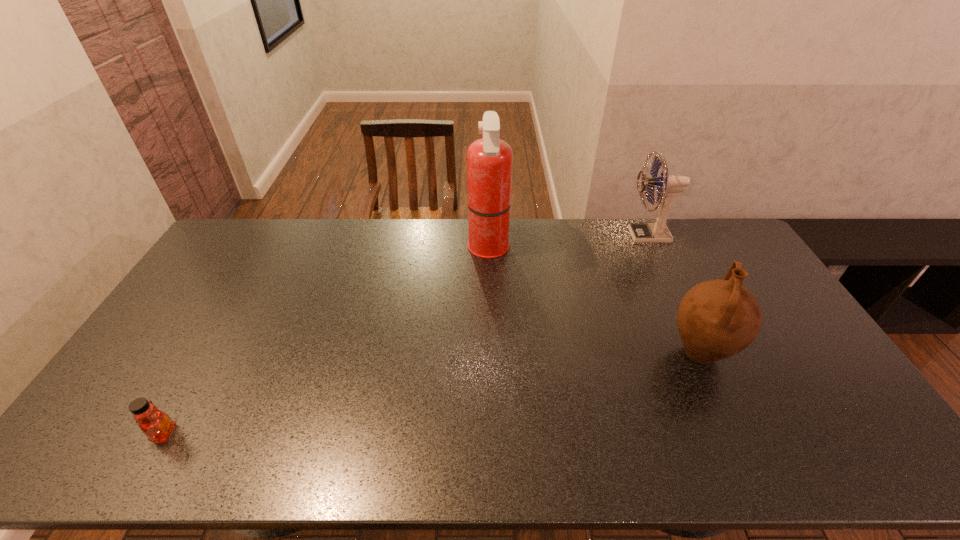
The width and height of the screenshot is (960, 540). What are the coordinates of `unoccupied position between the tallest object and the third farthest object` in the screenshot? It's located at (594, 301).

Where is `free space that is in between the tallest object and the pitcher`? The image size is (960, 540). free space that is in between the tallest object and the pitcher is located at coordinates (594, 301).

At what (x,y) coordinates should I click in order to perform the action: click on the second closest object relative to the fan. Please return your answer as a coordinate pair (x, y). This screenshot has height=540, width=960. Looking at the image, I should click on (489, 160).

This screenshot has width=960, height=540. Identify the location of object that is the second closest to the shortest object. (717, 319).

Locate an element on the screen. vacant space that satisfies the following two spatial constraints: 1. with the handle and hose on the pitcher; 2. on the right side of the fire extinguisher is located at coordinates (491, 354).

Image resolution: width=960 pixels, height=540 pixels. Find the location of `vacant region that satisfies the following two spatial constraints: 1. on the front-facing side of the fan; 2. on the front side of the second nearest object`. vacant region that satisfies the following two spatial constraints: 1. on the front-facing side of the fan; 2. on the front side of the second nearest object is located at coordinates (704, 354).

Identify the location of vacant region that satisfies the following two spatial constraints: 1. with the handle and hose on the second nearest object; 2. on the right side of the fire extinguisher. 491,354.

Locate an element on the screen. vacant region that satisfies the following two spatial constraints: 1. on the back side of the third farthest object; 2. with the handle and hose on the tallest object is located at coordinates (651, 249).

At what (x,y) coordinates should I click in order to perform the action: click on vacant area in the image that satisfies the following two spatial constraints: 1. with the handle and hose on the second nearest object; 2. on the left side of the tallest object. Please return your answer as a coordinate pair (x, y). This screenshot has width=960, height=540. Looking at the image, I should click on (491, 354).